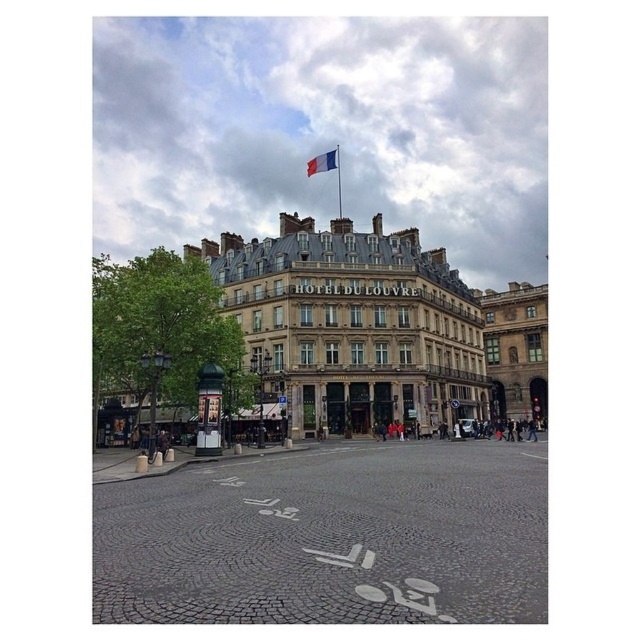
Is brown stone building at center positioned at the back of tricolor fabric flag at center top?

No, it is in front of tricolor fabric flag at center top.

Between point (358, 273) and point (316, 168), which one is positioned in front?

Point (358, 273) is in front.

Does point (428, 404) come in front of point (308, 173)?

That is True.

You are a GUI agent. You are given a task and a screenshot of the screen. Output one action in this format:
    pyautogui.click(x=<x>, y=<y>)
    Task: Click on the brown stone building at center
    
    Given the screenshot: What is the action you would take?
    pyautogui.click(x=353, y=324)

Can you confirm if tricolor fabric flag at center top is taller than blue metallic flag pole at upper center?

No.

In the scene shown: Does tricolor fabric flag at center top have a lesser width compared to blue metallic flag pole at upper center?

Incorrect, tricolor fabric flag at center top's width is not less than blue metallic flag pole at upper center's.

Where is `tricolor fabric flag at center top`? The width and height of the screenshot is (640, 640). tricolor fabric flag at center top is located at coordinates pyautogui.click(x=323, y=163).

Find the location of a particular element. The image size is (640, 640). tricolor fabric flag at center top is located at coordinates (323, 163).

Who is shorter, white cobblestone plaza at center or brown stone building at center?

Standing shorter between the two is white cobblestone plaza at center.

Does white cobblestone plaza at center have a larger size compared to brown stone building at center?

Actually, white cobblestone plaza at center might be smaller than brown stone building at center.

Is point (504, 532) positioned after point (426, 289)?

No, it is in front of (426, 289).

This screenshot has height=640, width=640. I want to click on white cobblestone plaza at center, so click(x=330, y=538).